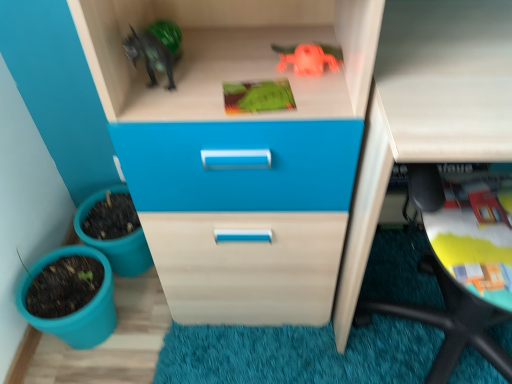
Question: From the image's perspective, is green matte toy at upper center, the 2th toy viewed from the top, on top of matte white computer desk at lower right?

Choices:
 (A) yes
 (B) no

Answer: (A)

Question: Considering the relative positions of green matte toy at upper center, the 2th toy viewed from the top, and matte white computer desk at lower right in the image provided, is green matte toy at upper center, the 2th toy viewed from the top, to the right of matte white computer desk at lower right from the viewer's perspective?

Choices:
 (A) yes
 (B) no

Answer: (B)

Question: Is green matte toy at upper center, the 2th toy viewed from the top, placed right next to matte white computer desk at lower right?

Choices:
 (A) yes
 (B) no

Answer: (B)

Question: Is green matte toy at upper center, the 2th toy viewed from the top, facing away from matte white computer desk at lower right?

Choices:
 (A) no
 (B) yes

Answer: (A)

Question: Is green matte toy at upper center, positioned as the first toy in bottom-to-top order, to the left of matte white computer desk at lower right from the viewer's perspective?

Choices:
 (A) no
 (B) yes

Answer: (B)

Question: Looking at the image, does matte plastic flowerpot at lower left, which is the 1th flowerpot in bottom-to-top order, seem bigger or smaller compared to green matte toy at upper center, the 2th toy viewed from the top?

Choices:
 (A) big
 (B) small

Answer: (A)

Question: Is matte plastic flowerpot at lower left, which is the 2th flowerpot from top to bottom, in front of or behind green matte toy at upper center, the 2th toy viewed from the top, in the image?

Choices:
 (A) front
 (B) behind

Answer: (B)

Question: Is matte plastic flowerpot at lower left, which is the 1th flowerpot in bottom-to-top order, wider or thinner than green matte toy at upper center, the 2th toy viewed from the top?

Choices:
 (A) thin
 (B) wide

Answer: (B)

Question: From their relative heights in the image, would you say matte plastic flowerpot at lower left, which is the 1th flowerpot in bottom-to-top order, is taller or shorter than green matte toy at upper center, the 2th toy viewed from the top?

Choices:
 (A) short
 (B) tall

Answer: (B)

Question: From a real-world perspective, is teal plastic flowerpot at lower left, which is the 1th flowerpot in top-to-bottom order, positioned above or below green matte toy at upper center, positioned as the first toy in bottom-to-top order?

Choices:
 (A) below
 (B) above

Answer: (A)

Question: Considering the positions of teal plastic flowerpot at lower left, which is the 1th flowerpot in top-to-bottom order, and green matte toy at upper center, positioned as the first toy in bottom-to-top order, in the image, is teal plastic flowerpot at lower left, which is the 1th flowerpot in top-to-bottom order, bigger or smaller than green matte toy at upper center, positioned as the first toy in bottom-to-top order,?

Choices:
 (A) small
 (B) big

Answer: (B)

Question: In terms of width, does teal plastic flowerpot at lower left, which is the 1th flowerpot in top-to-bottom order, look wider or thinner when compared to green matte toy at upper center, positioned as the first toy in bottom-to-top order?

Choices:
 (A) thin
 (B) wide

Answer: (B)

Question: From the image's perspective, is teal plastic flowerpot at lower left, which is the 1th flowerpot in top-to-bottom order, located above or below green matte toy at upper center, positioned as the first toy in bottom-to-top order?

Choices:
 (A) above
 (B) below

Answer: (B)

Question: Choose the correct answer: Is green matte toy at upper center, the 2th toy viewed from the top, inside rubber orange toy at upper center, positioned as the second toy in bottom-to-top order, or outside it?

Choices:
 (A) inside
 (B) outside

Answer: (B)

Question: From the image's perspective, is green matte toy at upper center, the 2th toy viewed from the top, above or below rubber orange toy at upper center, positioned as the second toy in bottom-to-top order?

Choices:
 (A) below
 (B) above

Answer: (A)